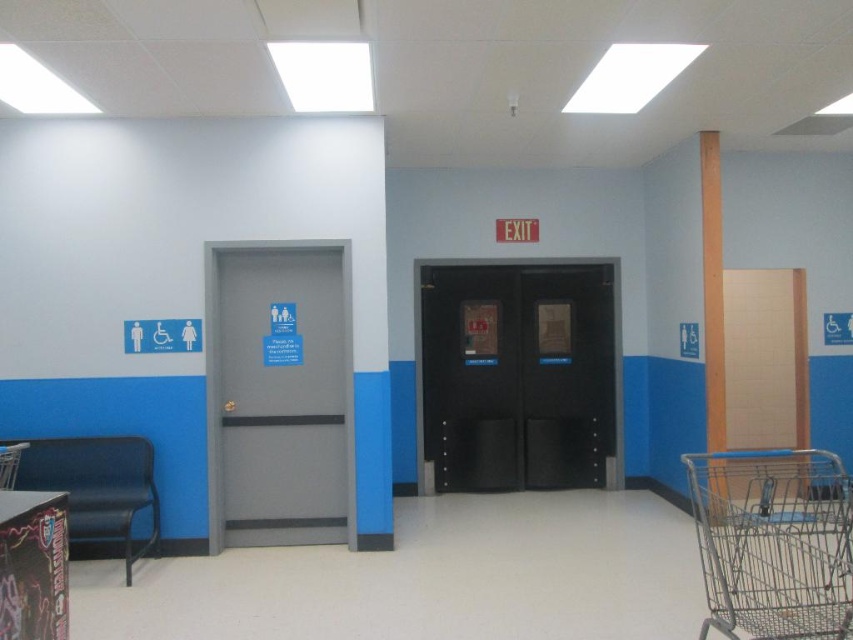
You are a person in a wheelchair needing to reach the restroom. You are currently positioned in front of the black metal elevator at center and the metallic blue bench at left. Which object should you move towards first to reach the restroom?

You should move towards the metallic blue bench at left first because the black metal elevator at center is further away from you than the metallic blue bench at left, so the bench is closer to your current position.

You are a delivery person needing to carry a large package through the store. The package is 1.8 meters wide. You see the black metal elevator at center and the metallic blue bench at left. Can the package fit through the elevator? Please explain your reasoning based on their widths.

The black metal elevator at center is wider than the metallic blue bench at left. However, since the bench width is unknown, we cannot determine if the elevator is wide enough for the 1.8 meter package. More information is needed.